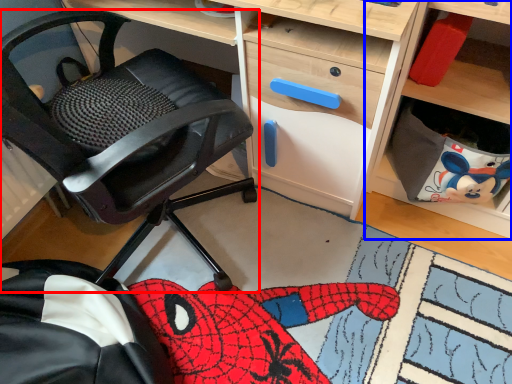
Question: Which object appears closest to the camera in this image, chair (highlighted by a red box) or shelf (highlighted by a blue box)?

Choices:
 (A) chair
 (B) shelf

Answer: (A)